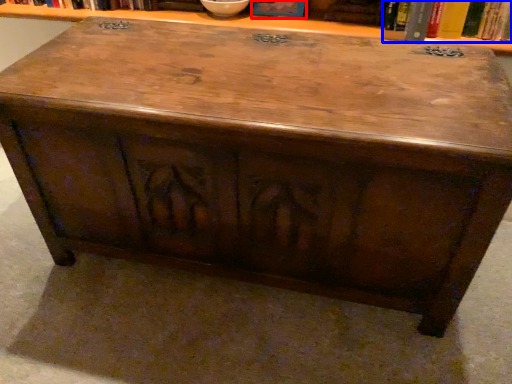
Question: Which object is closer to the camera taking this photo, book (highlighted by a red box) or book (highlighted by a blue box)?

Choices:
 (A) book
 (B) book

Answer: (B)